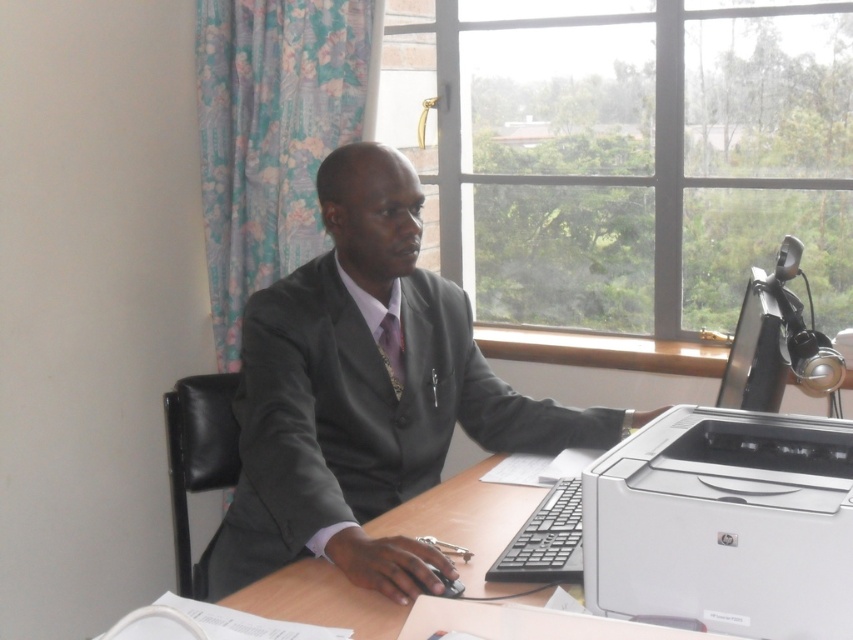
Question: Is clear glass window at upper center wider than patterned silk tie at center?

Choices:
 (A) no
 (B) yes

Answer: (B)

Question: Does clear glass window at upper center have a lesser width compared to patterned silk tie at center?

Choices:
 (A) yes
 (B) no

Answer: (B)

Question: Which object appears farthest from the camera in this image?

Choices:
 (A) clear glass window at upper center
 (B) matte gray suit at center
 (C) white matte printer at lower right
 (D) patterned silk tie at center

Answer: (A)

Question: Which point is farther to the camera?

Choices:
 (A) patterned silk tie at center
 (B) clear glass window at upper center
 (C) white matte printer at lower right
 (D) matte gray suit at center

Answer: (B)

Question: Which of the following is the farthest from the observer?

Choices:
 (A) (399, 369)
 (B) (567, 72)
 (C) (258, 413)
 (D) (752, 532)

Answer: (B)

Question: Is white matte printer at lower right below patterned silk tie at center?

Choices:
 (A) yes
 (B) no

Answer: (A)